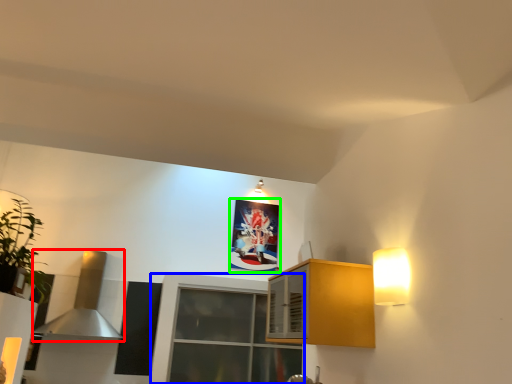
Question: Considering the real-world distances, which object is closest to exhaust hood (highlighted by a red box)? window (highlighted by a blue box) or picture frame (highlighted by a green box).

Choices:
 (A) window
 (B) picture frame

Answer: (A)